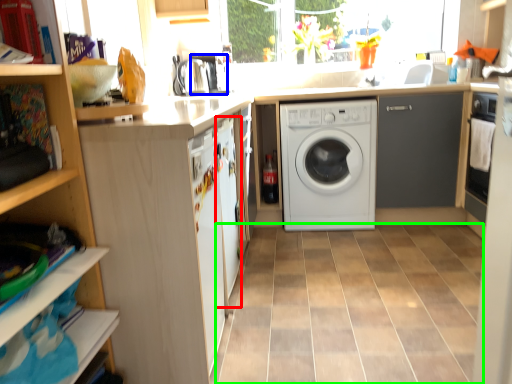
Question: Based on their relative distances, which object is farther from screen door (highlighted by a red box)? Choose from coffee machine (highlighted by a blue box) and ceramic tile (highlighted by a green box).

Choices:
 (A) coffee machine
 (B) ceramic tile

Answer: (A)